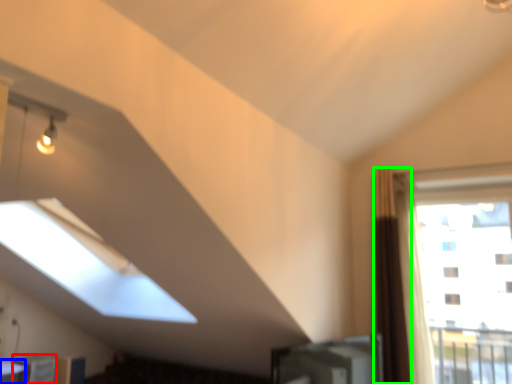
Question: Estimate the real-world distances between objects in this image. Which object is closer to furniture (highlighted by a red box), table (highlighted by a blue box) or curtain (highlighted by a green box)?

Choices:
 (A) table
 (B) curtain

Answer: (A)